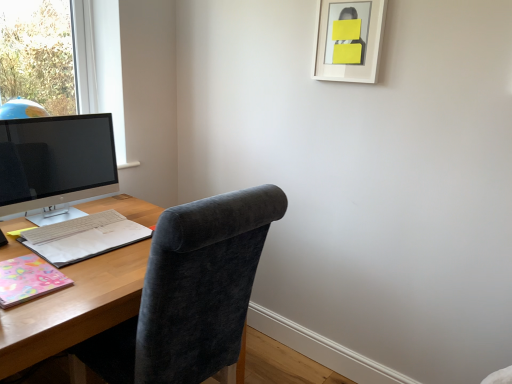
Question: From a real-world perspective, is multicolored paper notebook at left, acting as the second notebook starting from the front, on top of pastel floral paper at lower left, which is the 2th notebook from back to front?

Choices:
 (A) no
 (B) yes

Answer: (A)

Question: Can you confirm if multicolored paper notebook at left, acting as the first notebook starting from the back, is shorter than pastel floral paper at lower left, which is the 2th notebook from back to front?

Choices:
 (A) yes
 (B) no

Answer: (B)

Question: Is multicolored paper notebook at left, acting as the first notebook starting from the back, beside pastel floral paper at lower left, the first notebook from the front?

Choices:
 (A) no
 (B) yes

Answer: (A)

Question: Considering the relative sizes of multicolored paper notebook at left, acting as the first notebook starting from the back, and pastel floral paper at lower left, the first notebook from the front, in the image provided, is multicolored paper notebook at left, acting as the first notebook starting from the back, wider than pastel floral paper at lower left, the first notebook from the front,?

Choices:
 (A) yes
 (B) no

Answer: (A)

Question: Is multicolored paper notebook at left, acting as the second notebook starting from the front, outside pastel floral paper at lower left, the first notebook from the front?

Choices:
 (A) no
 (B) yes

Answer: (B)

Question: From the image's perspective, does multicolored paper notebook at left, acting as the second notebook starting from the front, appear higher than pastel floral paper at lower left, which is the 2th notebook from back to front?

Choices:
 (A) yes
 (B) no

Answer: (A)

Question: From a real-world perspective, is dark gray fabric chair at center under wooden desk at center?

Choices:
 (A) no
 (B) yes

Answer: (A)

Question: Does dark gray fabric chair at center touch wooden desk at center?

Choices:
 (A) no
 (B) yes

Answer: (A)

Question: Does dark gray fabric chair at center come behind wooden desk at center?

Choices:
 (A) yes
 (B) no

Answer: (B)

Question: Does dark gray fabric chair at center have a lesser height compared to wooden desk at center?

Choices:
 (A) yes
 (B) no

Answer: (B)

Question: Considering the relative sizes of dark gray fabric chair at center and wooden desk at center in the image provided, is dark gray fabric chair at center thinner than wooden desk at center?

Choices:
 (A) no
 (B) yes

Answer: (B)

Question: Is there a large distance between dark gray fabric chair at center and wooden desk at center?

Choices:
 (A) yes
 (B) no

Answer: (B)

Question: Is satin black monitor at left shorter than multicolored paper notebook at left, acting as the first notebook starting from the back?

Choices:
 (A) yes
 (B) no

Answer: (B)